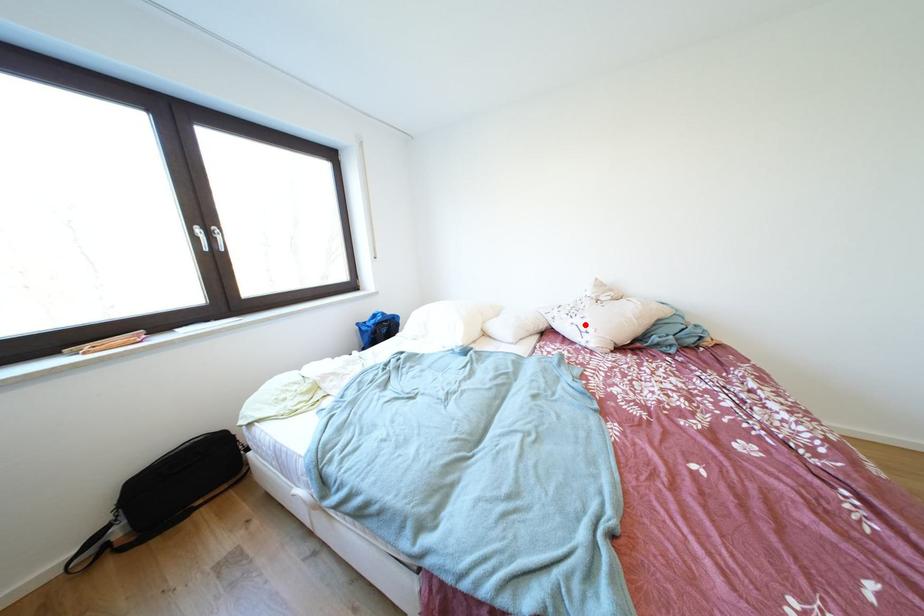
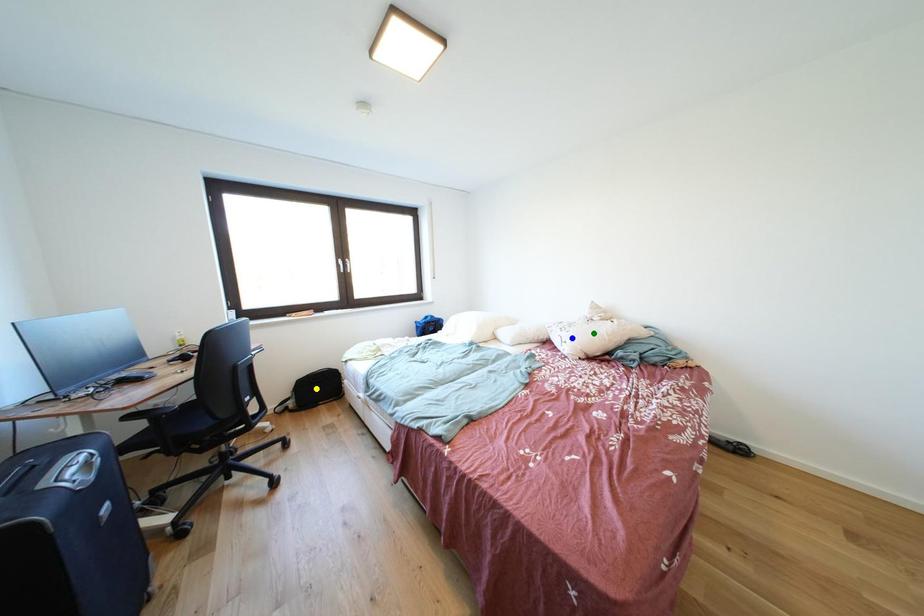
Question: I am providing you with two images of the same scene from different viewpoints. A red point is marked on the first image. You are given multiple points on the second image. In image 2, which mark is for the same physical point as the one in image 1?

Choices:
 (A) yellow point
 (B) green point
 (C) blue point

Answer: (C)